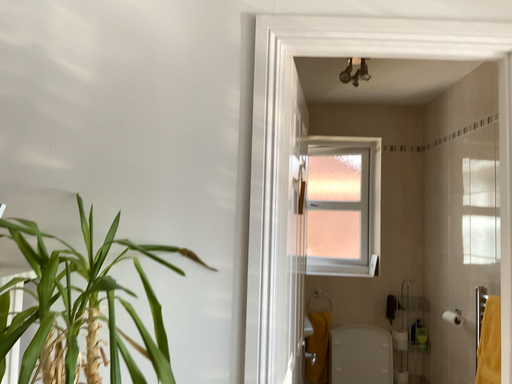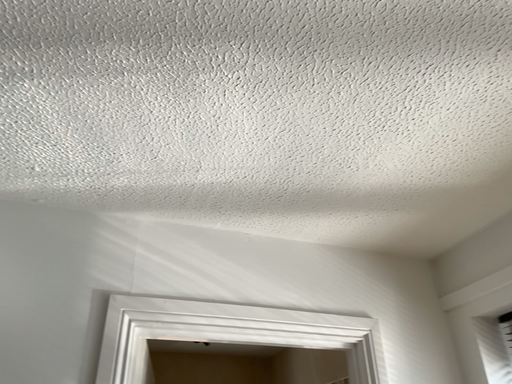
Question: How did the camera likely rotate when shooting the video?

Choices:
 (A) rotated downward
 (B) rotated upward

Answer: (B)